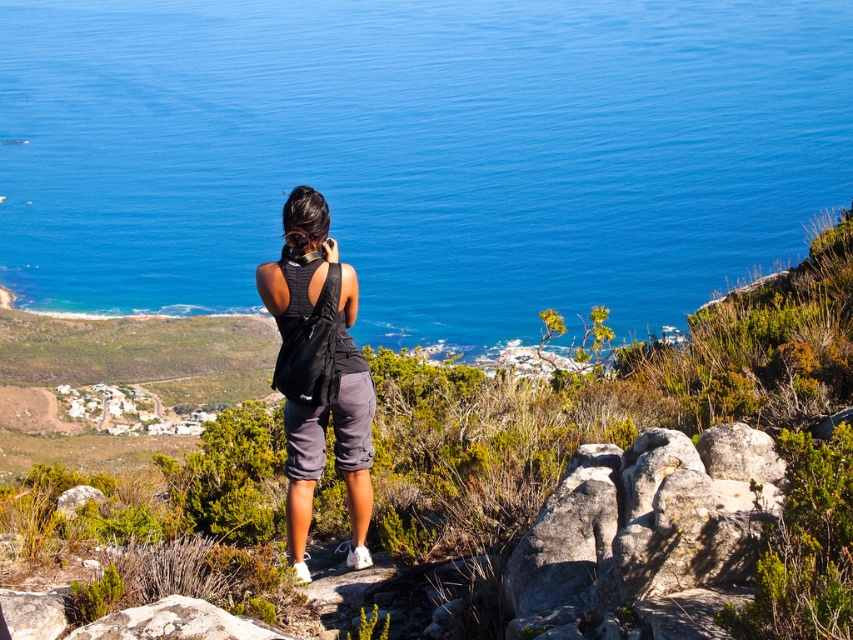
Question: Observing the image, what is the correct spatial positioning of black fabric backpack at center in reference to gray rough rock at lower left?

Choices:
 (A) below
 (B) above

Answer: (B)

Question: Considering the real-world distances, which object is farthest from the gray rock at lower right?

Choices:
 (A) blue water at center
 (B) black fabric backpack at center

Answer: (A)

Question: Estimate the real-world distances between objects in this image. Which object is closer to the blue water at center?

Choices:
 (A) gray rough rock at lower left
 (B) gray rock at lower right
 (C) black fabric backpack at center

Answer: (B)

Question: Is blue water at center positioned behind black fabric backpack at center?

Choices:
 (A) no
 (B) yes

Answer: (B)

Question: Which is nearer to the gray rock at lower right?

Choices:
 (A) blue water at center
 (B) black fabric backpack at center

Answer: (B)

Question: Is gray rock at lower right closer to camera compared to gray rough rock at lower left?

Choices:
 (A) yes
 (B) no

Answer: (A)